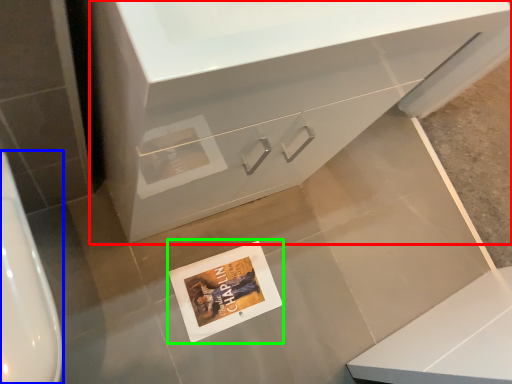
Question: Which object is positioned closest to bathroom cabinet (highlighted by a red box)? Select from urinal (highlighted by a blue box) and postcard (highlighted by a green box).

Choices:
 (A) urinal
 (B) postcard

Answer: (A)